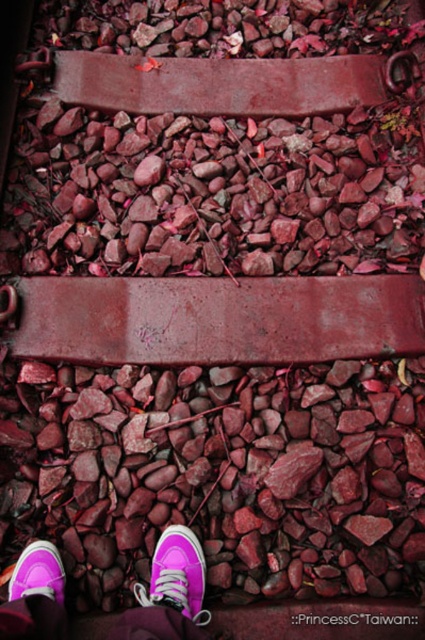
Question: Which of the following is the farthest from the observer?

Choices:
 (A) purple suede shoe at lower left
 (B) pink suede sneaker at lower center
 (C) purple suede sneakers at lower left
 (D) reddish-brown stone gravel at center

Answer: (D)

Question: Which point is closer to the camera?

Choices:
 (A) purple suede sneakers at lower left
 (B) purple suede shoe at lower left

Answer: (A)

Question: Does pink suede sneaker at lower center have a greater width compared to purple suede shoe at lower left?

Choices:
 (A) yes
 (B) no

Answer: (A)

Question: Which object appears farthest from the camera in this image?

Choices:
 (A) purple suede shoe at lower left
 (B) reddish-brown stone gravel at center

Answer: (B)

Question: Where is purple suede sneakers at lower left located in relation to pink suede sneaker at lower center in the image?

Choices:
 (A) above
 (B) below

Answer: (B)

Question: Is purple suede sneakers at lower left wider than pink suede sneaker at lower center?

Choices:
 (A) no
 (B) yes

Answer: (B)